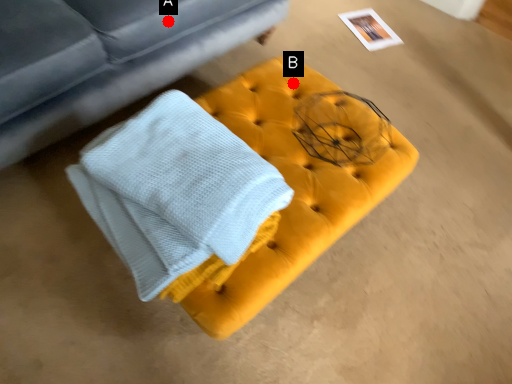
Question: Two points are circled on the image, labeled by A and B beside each circle. Which of the following is the closest to the observer?

Choices:
 (A) A is closer
 (B) B is closer

Answer: (B)